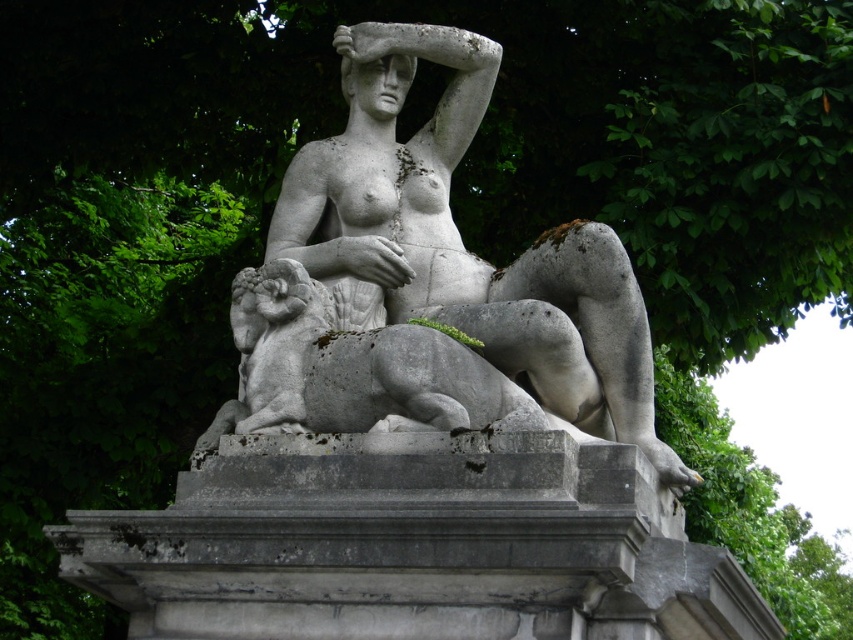
What do you see at coordinates (462, 243) in the screenshot? I see `gray stone statue at center` at bounding box center [462, 243].

From the picture: Is gray stone statue at center thinner than gray stone lion at center?

Incorrect, gray stone statue at center's width is not less than gray stone lion at center's.

Between point (410, 307) and point (474, 364), which one is positioned in front?

Point (474, 364) is in front.

Locate an element on the screen. This screenshot has width=853, height=640. gray stone statue at center is located at coordinates (462, 243).

Is point (351, 49) farther from camera compared to point (543, 426)?

That is True.

Can you confirm if white stone statue at center is wider than gray stone lion at center?

Incorrect, white stone statue at center's width does not surpass gray stone lion at center's.

Which is behind, point (412, 202) or point (285, 388)?

The point (412, 202) is behind.

Where is `white stone statue at center`? This screenshot has height=640, width=853. white stone statue at center is located at coordinates (390, 172).

Is gray stone statue at center bigger than white stone statue at center?

Indeed, gray stone statue at center has a larger size compared to white stone statue at center.

Looking at this image, who is positioned more to the right, gray stone statue at center or white stone statue at center?

From the viewer's perspective, gray stone statue at center appears more on the right side.

Who is more distant from viewer, (490, 321) or (364, 252)?

Positioned behind is point (364, 252).

Image resolution: width=853 pixels, height=640 pixels. Find the location of `gray stone statue at center`. gray stone statue at center is located at coordinates (462, 243).